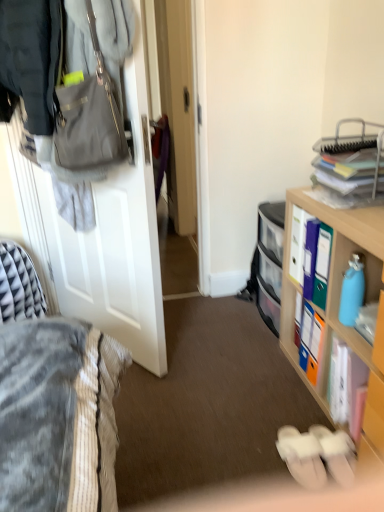
Question: Which direction should I rotate to look at white fabric slippers at lower center, the 2th footwear viewed from the right, — up or down?

Choices:
 (A) down
 (B) up

Answer: (A)

Question: Is white matte door at left at the left side of clear plastic drawers at center?

Choices:
 (A) no
 (B) yes

Answer: (B)

Question: Is white matte door at left closer to camera compared to clear plastic drawers at center?

Choices:
 (A) yes
 (B) no

Answer: (A)

Question: Does white matte door at left have a smaller size compared to clear plastic drawers at center?

Choices:
 (A) no
 (B) yes

Answer: (A)

Question: Would you say clear plastic drawers at center is part of white matte door at left's contents?

Choices:
 (A) no
 (B) yes

Answer: (A)

Question: Is white matte door at left oriented towards clear plastic drawers at center?

Choices:
 (A) no
 (B) yes

Answer: (B)

Question: Can you confirm if white matte door at left is wider than clear plastic drawers at center?

Choices:
 (A) no
 (B) yes

Answer: (B)

Question: Can you confirm if matte gray handbag at upper left is wider than wooden cabinet at right?

Choices:
 (A) no
 (B) yes

Answer: (A)

Question: From a real-world perspective, is matte gray handbag at upper left beneath wooden cabinet at right?

Choices:
 (A) yes
 (B) no

Answer: (B)

Question: Is matte gray handbag at upper left positioned in front of wooden cabinet at right?

Choices:
 (A) no
 (B) yes

Answer: (B)

Question: Can you confirm if matte gray handbag at upper left is smaller than wooden cabinet at right?

Choices:
 (A) yes
 (B) no

Answer: (A)

Question: Is matte gray handbag at upper left shorter than wooden cabinet at right?

Choices:
 (A) yes
 (B) no

Answer: (A)

Question: Is matte gray handbag at upper left bigger than wooden cabinet at right?

Choices:
 (A) yes
 (B) no

Answer: (B)

Question: Can you confirm if white fabric slippers at lower center, positioned as the second footwear in left-to-right order, is smaller than clear plastic drawers at center?

Choices:
 (A) no
 (B) yes

Answer: (B)